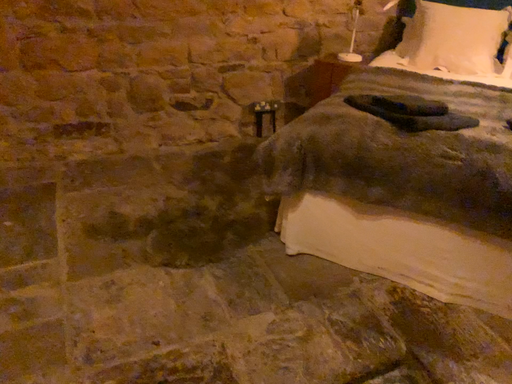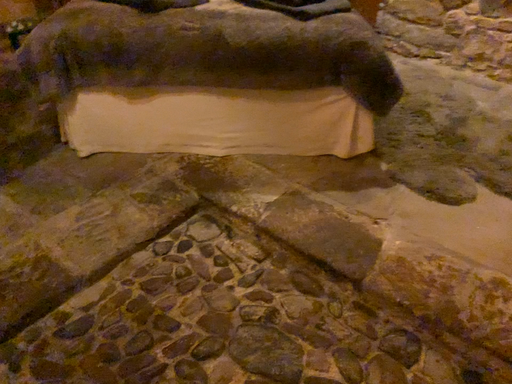
Question: How did the camera likely rotate when shooting the video?

Choices:
 (A) rotated left
 (B) rotated right

Answer: (B)